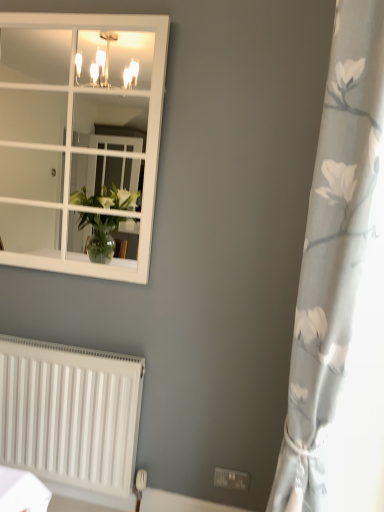
This screenshot has width=384, height=512. In order to click on light blue floral fabric curtain at right in this screenshot , I will do `click(333, 250)`.

Measure the distance between point (x=334, y=103) and camera.

Point (x=334, y=103) and camera are 27.44 inches apart from each other.

The height and width of the screenshot is (512, 384). What do you see at coordinates (333, 250) in the screenshot?
I see `light blue floral fabric curtain at right` at bounding box center [333, 250].

Locate an element on the screen. light blue floral fabric curtain at right is located at coordinates (333, 250).